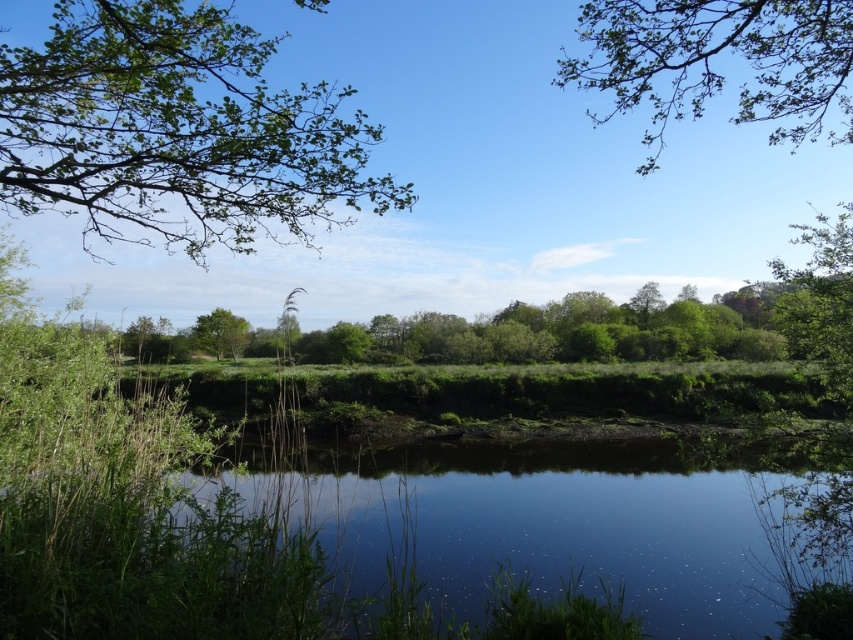
Question: Among these objects, which one is farthest from the camera?

Choices:
 (A) green leafy branches at upper right
 (B) green leafy tree at center
 (C) green leafy branches at upper left

Answer: (B)

Question: Which object is farther from the camera taking this photo?

Choices:
 (A) green leafy branches at upper left
 (B) green leafy branches at upper right

Answer: (B)

Question: Is green leafy branches at upper right smaller than green leafy tree at center?

Choices:
 (A) yes
 (B) no

Answer: (B)

Question: Is green leafy branches at upper right smaller than green leafy tree at center?

Choices:
 (A) yes
 (B) no

Answer: (B)

Question: Where is green leafy branches at upper right located in relation to green leafy tree at center in the image?

Choices:
 (A) left
 (B) right

Answer: (B)

Question: Which object is positioned farthest from the green leafy tree at center?

Choices:
 (A) green leafy branches at upper right
 (B) green leafy branches at upper left

Answer: (A)